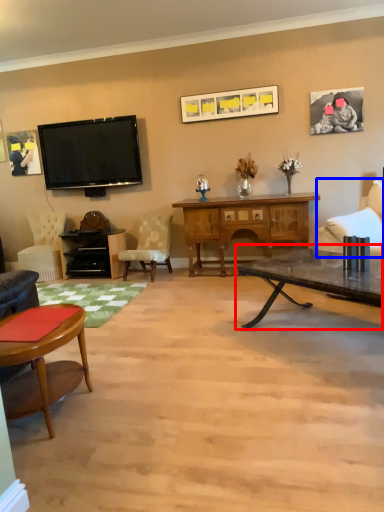
Question: Which object appears closest to the camera in this image, coffee table (highlighted by a red box) or chair (highlighted by a blue box)?

Choices:
 (A) coffee table
 (B) chair

Answer: (A)